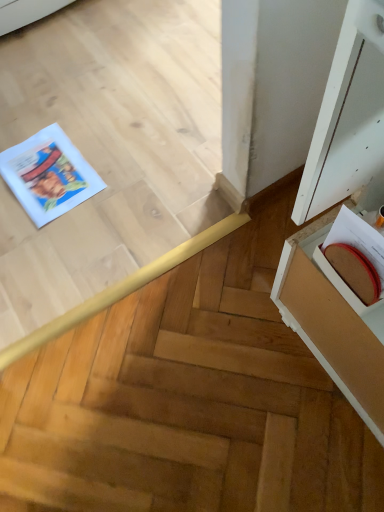
Question: Considering the relative positions of white wood cabinet at right and white paper comic book at left in the image provided, is white wood cabinet at right to the left of white paper comic book at left from the viewer's perspective?

Choices:
 (A) no
 (B) yes

Answer: (A)

Question: Is white wood cabinet at right positioned before white paper comic book at left?

Choices:
 (A) no
 (B) yes

Answer: (B)

Question: Does white wood cabinet at right have a larger size compared to white paper comic book at left?

Choices:
 (A) no
 (B) yes

Answer: (B)

Question: Can you confirm if white wood cabinet at right is shorter than white paper comic book at left?

Choices:
 (A) no
 (B) yes

Answer: (A)

Question: Is the position of white wood cabinet at right more distant than that of white paper comic book at left?

Choices:
 (A) yes
 (B) no

Answer: (B)

Question: Considering the positions of point (334, 136) and point (11, 162), is point (334, 136) closer or farther from the camera than point (11, 162)?

Choices:
 (A) closer
 (B) farther

Answer: (A)

Question: Is white wood cabinet at right spatially inside white paper comic book at left, or outside of it?

Choices:
 (A) inside
 (B) outside

Answer: (B)

Question: Considering the positions of white wood cabinet at right and white paper comic book at left in the image, is white wood cabinet at right taller or shorter than white paper comic book at left?

Choices:
 (A) tall
 (B) short

Answer: (A)

Question: From a real-world perspective, is white wood cabinet at right above or below white paper comic book at left?

Choices:
 (A) below
 (B) above

Answer: (B)

Question: Does point (367, 258) appear closer or farther from the camera than point (23, 175)?

Choices:
 (A) closer
 (B) farther

Answer: (A)

Question: In terms of size, does matte brown book at right appear bigger or smaller than white paper comic book at left?

Choices:
 (A) small
 (B) big

Answer: (A)

Question: Considering the positions of matte brown book at right and white paper comic book at left in the image, is matte brown book at right taller or shorter than white paper comic book at left?

Choices:
 (A) tall
 (B) short

Answer: (A)

Question: Choose the correct answer: Is matte brown book at right inside white paper comic book at left or outside it?

Choices:
 (A) inside
 (B) outside

Answer: (B)

Question: In the image, is white wood cabinet at right positioned in front of or behind matte brown book at right?

Choices:
 (A) front
 (B) behind

Answer: (A)

Question: From a real-world perspective, is white wood cabinet at right physically located above or below matte brown book at right?

Choices:
 (A) above
 (B) below

Answer: (A)